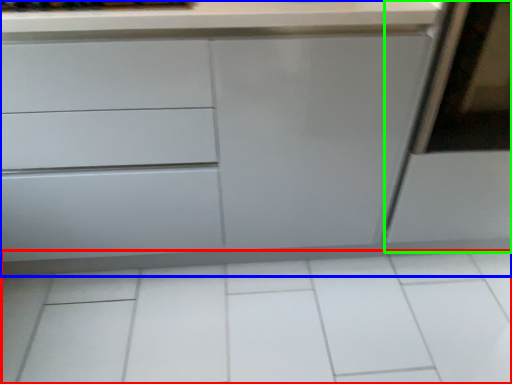
Question: Considering the real-world distances, which object is closest to ceramic tile (highlighted by a red box)? chest of drawers (highlighted by a blue box) or screen door (highlighted by a green box).

Choices:
 (A) chest of drawers
 (B) screen door

Answer: (A)